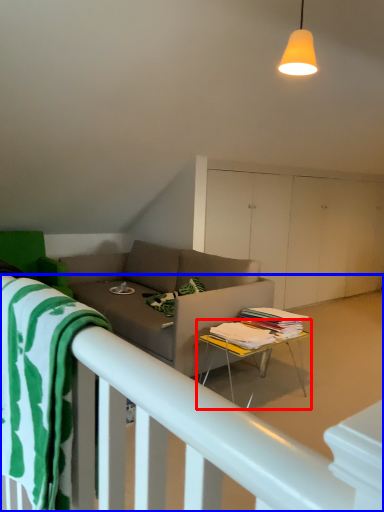
Question: Among these objects, which one is farthest to the camera, table (highlighted by a red box) or bed frame (highlighted by a blue box)?

Choices:
 (A) table
 (B) bed frame

Answer: (A)